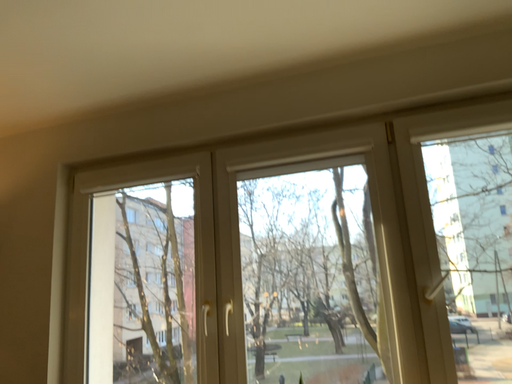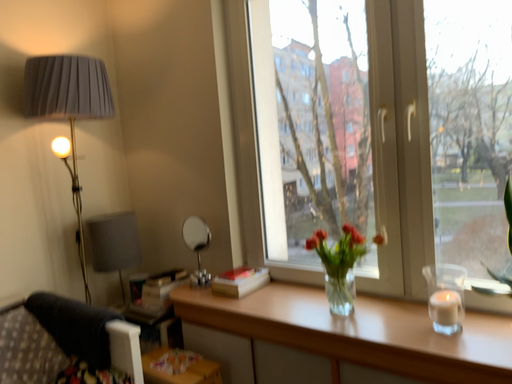
Question: Which way did the camera rotate in the video?

Choices:
 (A) rotated downward
 (B) rotated upward

Answer: (A)